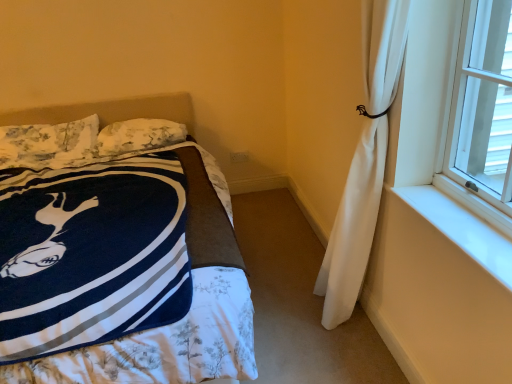
Question: From the image's perspective, is navy blue fleece blanket at left beneath fluffy white pillow at upper left, the first pillow when ordered from right to left?

Choices:
 (A) yes
 (B) no

Answer: (A)

Question: Is navy blue fleece blanket at left at the right side of fluffy white pillow at upper left, the first pillow when ordered from right to left?

Choices:
 (A) no
 (B) yes

Answer: (A)

Question: Is navy blue fleece blanket at left thinner than fluffy white pillow at upper left, the first pillow when ordered from right to left?

Choices:
 (A) no
 (B) yes

Answer: (A)

Question: Does navy blue fleece blanket at left have a greater height compared to fluffy white pillow at upper left, the 2th pillow in the left-to-right sequence?

Choices:
 (A) no
 (B) yes

Answer: (B)

Question: Is navy blue fleece blanket at left facing away from fluffy white pillow at upper left, the first pillow when ordered from right to left?

Choices:
 (A) no
 (B) yes

Answer: (B)

Question: Is navy blue fleece blanket at left positioned before fluffy white pillow at upper left, the 2th pillow in the left-to-right sequence?

Choices:
 (A) no
 (B) yes

Answer: (B)

Question: Does floral fabric pillow at upper left, which is the second pillow from right to left, have a lesser height compared to white smooth window sill at right?

Choices:
 (A) yes
 (B) no

Answer: (B)

Question: Is white smooth window sill at right inside floral fabric pillow at upper left, which is the second pillow from right to left?

Choices:
 (A) no
 (B) yes

Answer: (A)

Question: Are floral fabric pillow at upper left, arranged as the 1th pillow when viewed from the left, and white smooth window sill at right located far from each other?

Choices:
 (A) yes
 (B) no

Answer: (A)

Question: Is floral fabric pillow at upper left, arranged as the 1th pillow when viewed from the left, further to the viewer compared to white smooth window sill at right?

Choices:
 (A) yes
 (B) no

Answer: (A)

Question: Does floral fabric pillow at upper left, arranged as the 1th pillow when viewed from the left, have a smaller size compared to white smooth window sill at right?

Choices:
 (A) yes
 (B) no

Answer: (B)

Question: Is floral fabric pillow at upper left, arranged as the 1th pillow when viewed from the left, located outside white smooth window sill at right?

Choices:
 (A) no
 (B) yes

Answer: (B)

Question: Considering the relative sizes of floral fabric pillow at upper left, arranged as the 1th pillow when viewed from the left, and navy blue fleece blanket at left in the image provided, is floral fabric pillow at upper left, arranged as the 1th pillow when viewed from the left, smaller than navy blue fleece blanket at left?

Choices:
 (A) yes
 (B) no

Answer: (A)